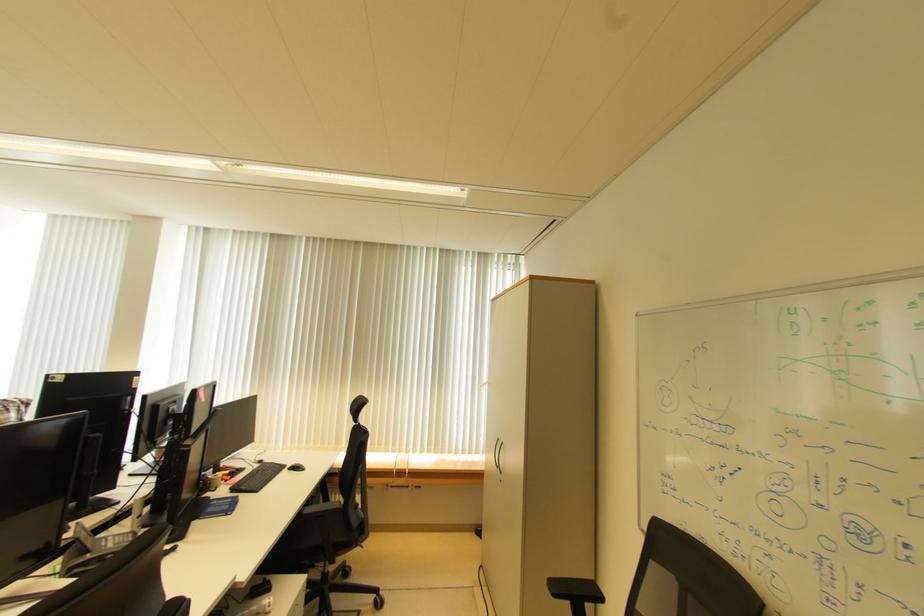
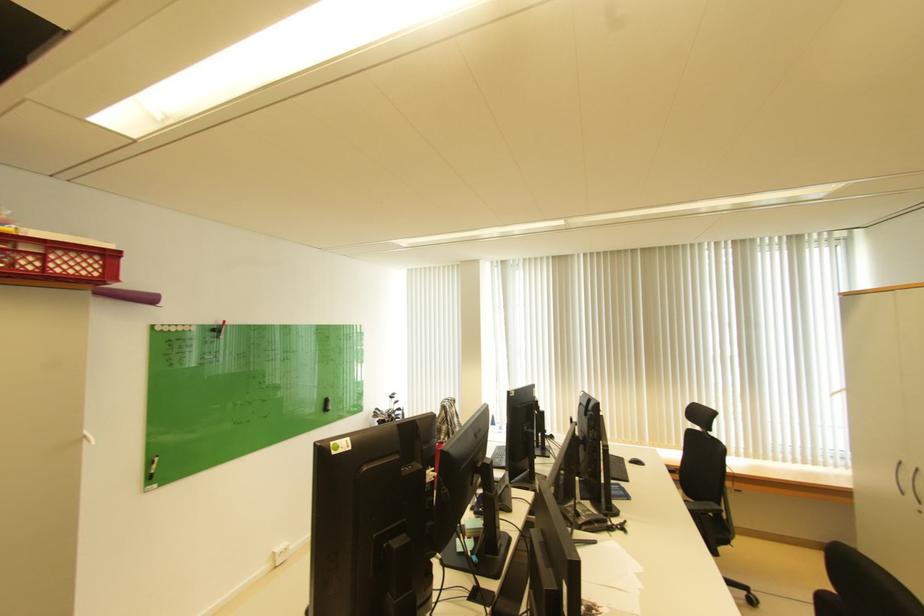
The point at (298, 467) is marked in the first image. Where is the corresponding point in the second image?

(638, 461)